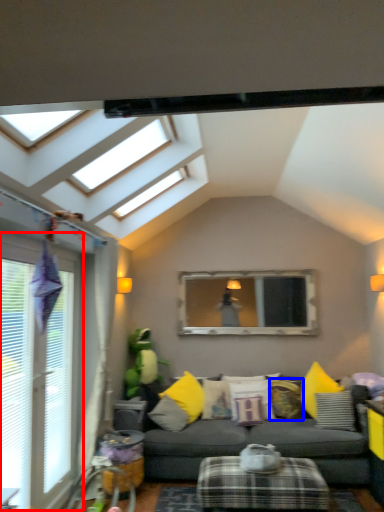
Question: Which object appears farthest to the camera in this image, window (highlighted by a red box) or pillow (highlighted by a blue box)?

Choices:
 (A) window
 (B) pillow

Answer: (B)